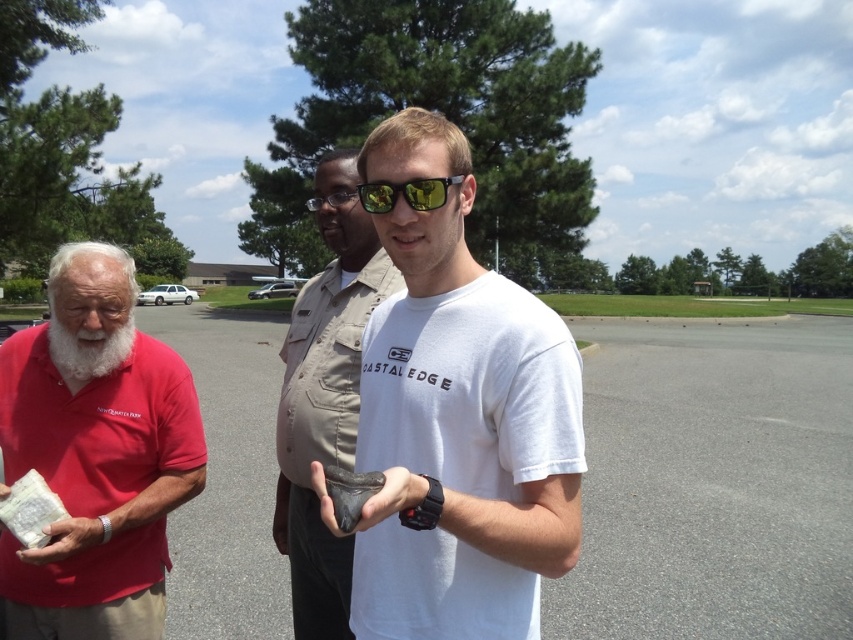
Can you confirm if white matte t-shirt at center is thinner than whitehairbeard at left?

In fact, white matte t-shirt at center might be wider than whitehairbeard at left.

Can you confirm if white matte t-shirt at center is positioned above whitehairbeard at left?

No, white matte t-shirt at center is not above whitehairbeard at left.

At what (x,y) coordinates should I click in order to perform the action: click on white matte t-shirt at center. Please return your answer as a coordinate pair (x, y). The height and width of the screenshot is (640, 853). Looking at the image, I should click on (457, 420).

Can you confirm if gray asphalt parking lot at center is positioned below matte red shirt at left?

Yes.

Is gray asphalt parking lot at center thinner than matte red shirt at left?

No.

Does point (219, 531) lie in front of point (86, 618)?

No, it is not.

Locate an element on the screen. The height and width of the screenshot is (640, 853). gray asphalt parking lot at center is located at coordinates (712, 483).

Between white matte t-shirt at center and matte red shirt at left, which one is positioned lower?

matte red shirt at left

Which is in front, point (509, 468) or point (173, 486)?

Positioned in front is point (509, 468).

Between point (387, 387) and point (140, 477), which one is positioned behind?

Positioned behind is point (140, 477).

At what (x,y) coordinates should I click in order to perform the action: click on white matte t-shirt at center. Please return your answer as a coordinate pair (x, y). Looking at the image, I should click on (457, 420).